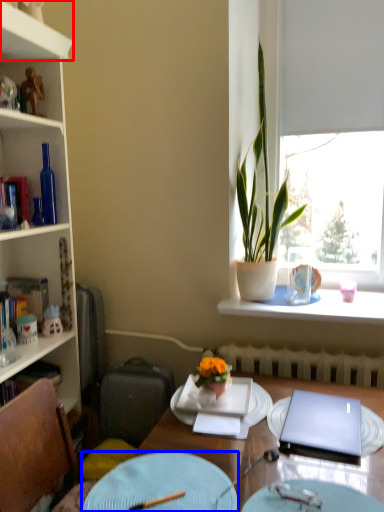
Question: Which of the following is the closest to the observer, cabinet (highlighted by a red box) or plate (highlighted by a blue box)?

Choices:
 (A) cabinet
 (B) plate

Answer: (B)